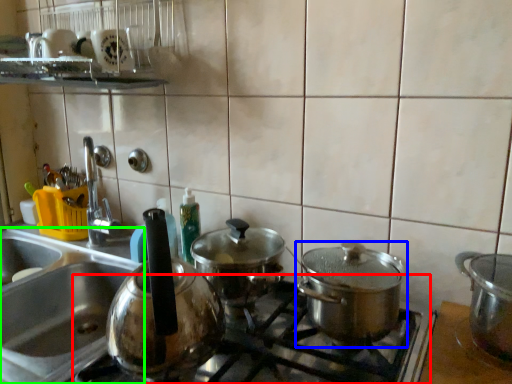
Question: Which object is positioned farthest from gas stove (highlighted by a red box)? Select from kitchen appliance (highlighted by a blue box) and sink (highlighted by a green box).

Choices:
 (A) kitchen appliance
 (B) sink

Answer: (B)